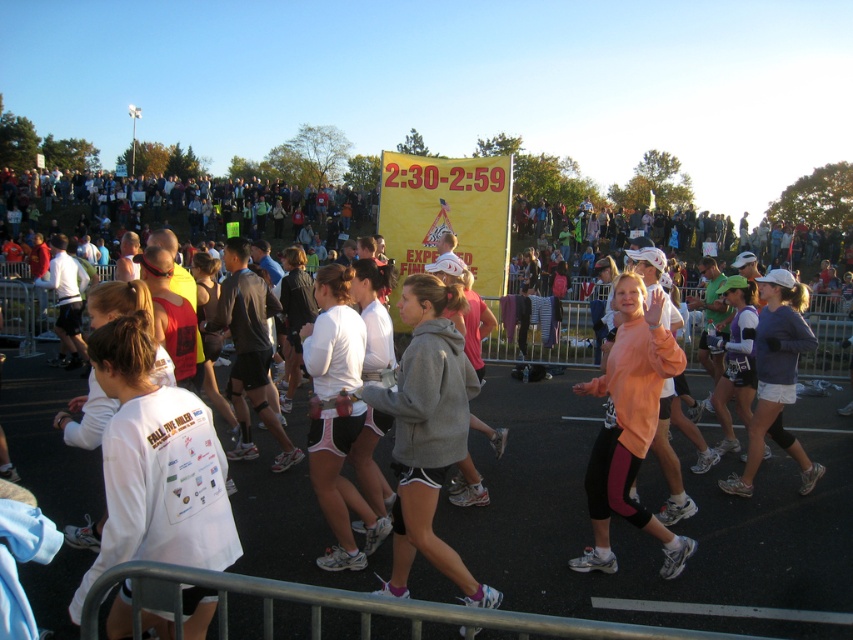
Question: Considering the real-world distances, which object is farthest from the white matte shirt at center?

Choices:
 (A) gray fleece sweatshirt at center
 (B) pink matte leggings at center

Answer: (B)

Question: Can you confirm if white matte shirt at center is bigger than gray fleece sweatshirt at center?

Choices:
 (A) no
 (B) yes

Answer: (A)

Question: Can you confirm if gray fleece sweatshirt at center is positioned to the right of pink matte leggings at center?

Choices:
 (A) no
 (B) yes

Answer: (A)

Question: Is white matte shirt at center behind pink matte leggings at center?

Choices:
 (A) no
 (B) yes

Answer: (A)

Question: Which is nearer to the white matte shirt at center?

Choices:
 (A) pink matte leggings at center
 (B) gray fleece sweatshirt at center

Answer: (B)

Question: Which of the following is the farthest from the observer?

Choices:
 (A) (183, 444)
 (B) (408, 300)
 (C) (668, 362)

Answer: (C)